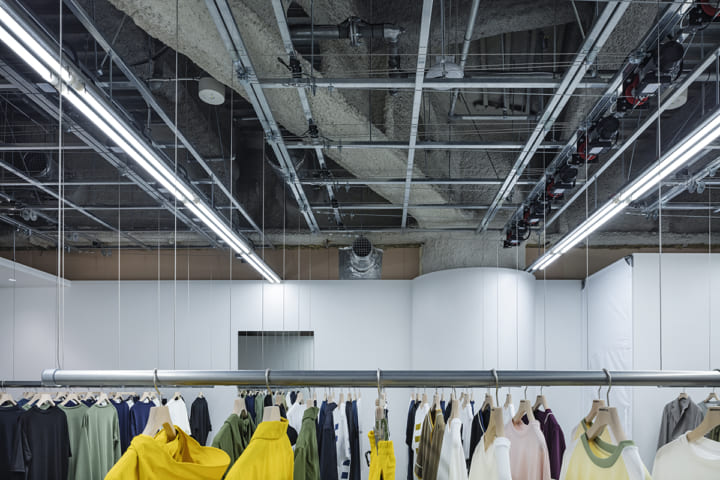
Where is `lights`? The image size is (720, 480). lights is located at coordinates (567, 248).